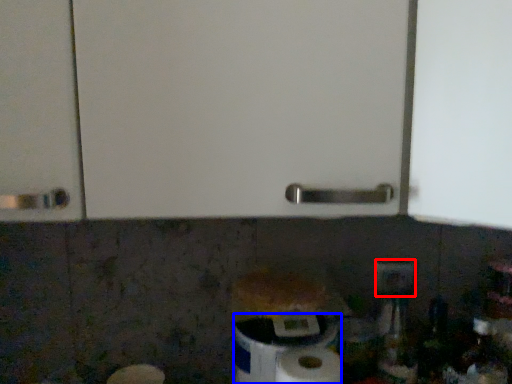
Question: Which object is closer to the camera taking this photo, electric outlet (highlighted by a red box) or toilet paper (highlighted by a blue box)?

Choices:
 (A) electric outlet
 (B) toilet paper

Answer: (B)